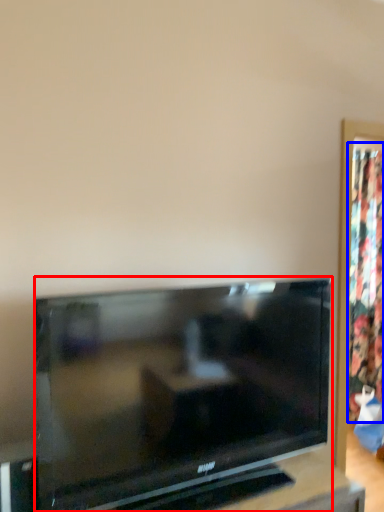
Question: Among these objects, which one is farthest to the camera, television (highlighted by a red box) or curtain (highlighted by a blue box)?

Choices:
 (A) television
 (B) curtain

Answer: (B)